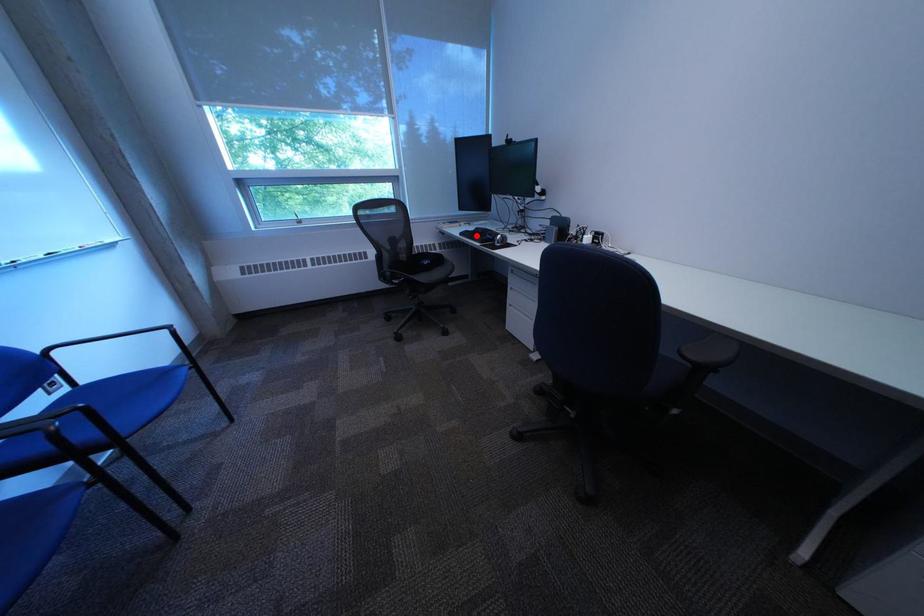
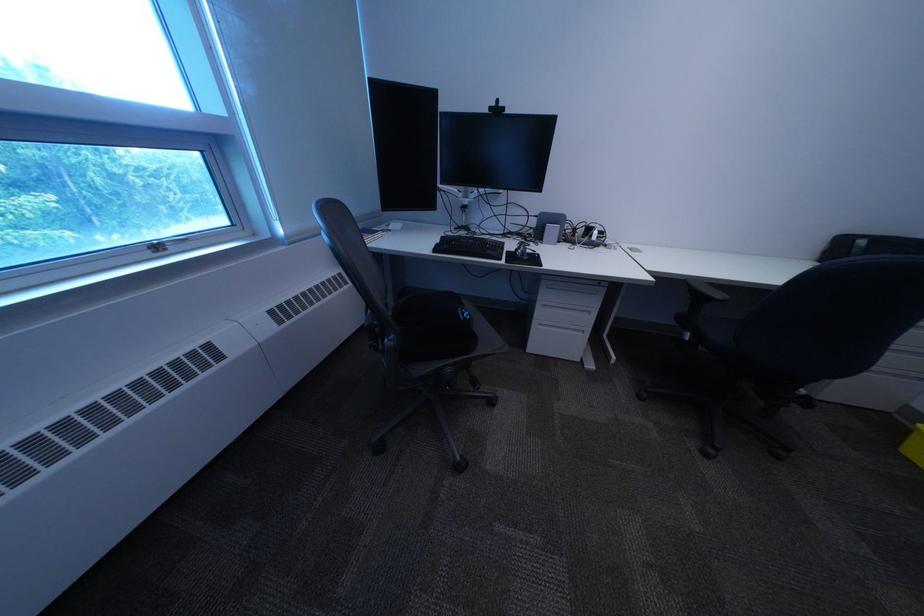
The point at the highlighted location is marked in the first image. Where is the corresponding point in the second image?

(451, 252)